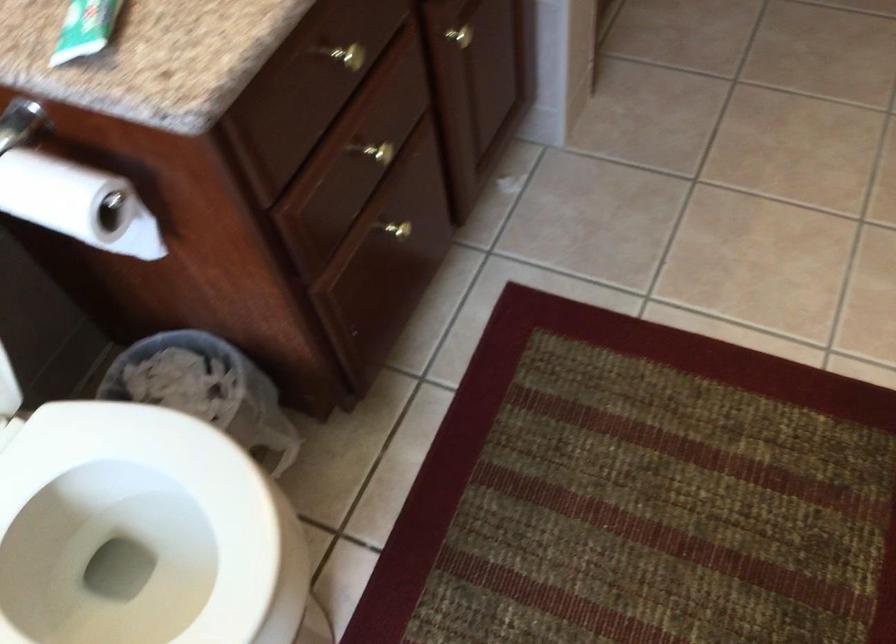
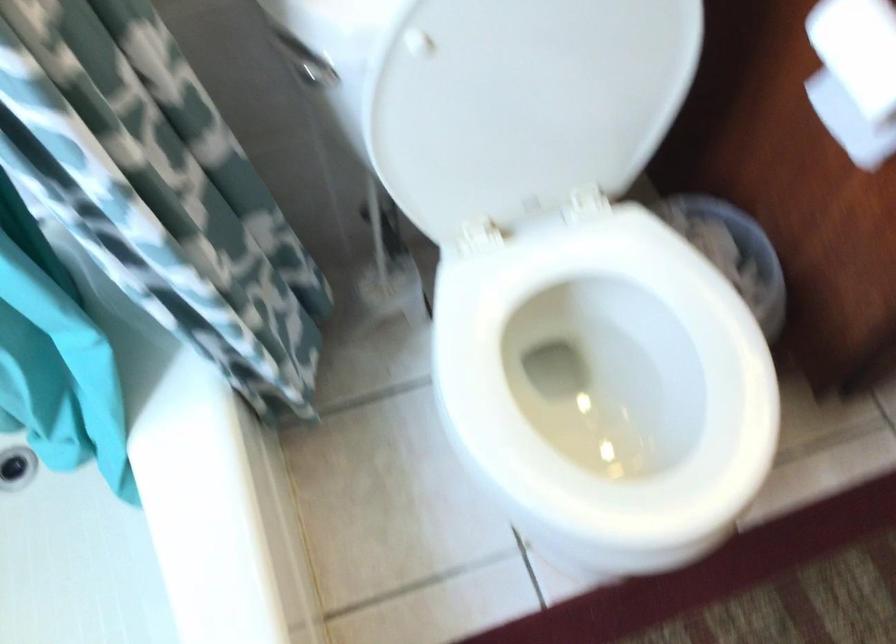
Question: The camera is either moving clockwise (left) or counter-clockwise (right) around the object. The first image is from the beginning of the video and the second image is from the end. Is the camera moving left or right when shooting the video?

Choices:
 (A) Left
 (B) Right

Answer: (B)